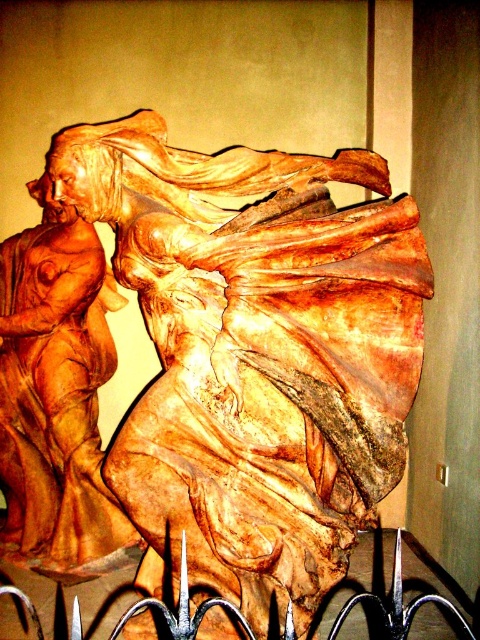
Question: Does wooden statue at center appear on the right side of wooden statue at left?

Choices:
 (A) yes
 (B) no

Answer: (A)

Question: Which point appears closest to the camera in this image?

Choices:
 (A) (6, 548)
 (B) (216, 365)

Answer: (B)

Question: From the image, what is the correct spatial relationship of wooden statue at center in relation to wooden statue at left?

Choices:
 (A) above
 (B) below

Answer: (A)

Question: Which point appears closest to the camera in this image?

Choices:
 (A) (79, 406)
 (B) (133, 150)

Answer: (B)

Question: Can you confirm if wooden statue at center is positioned to the right of wooden statue at left?

Choices:
 (A) no
 (B) yes

Answer: (B)

Question: Among these points, which one is farthest from the camera?

Choices:
 (A) (347, 264)
 (B) (101, 504)

Answer: (B)